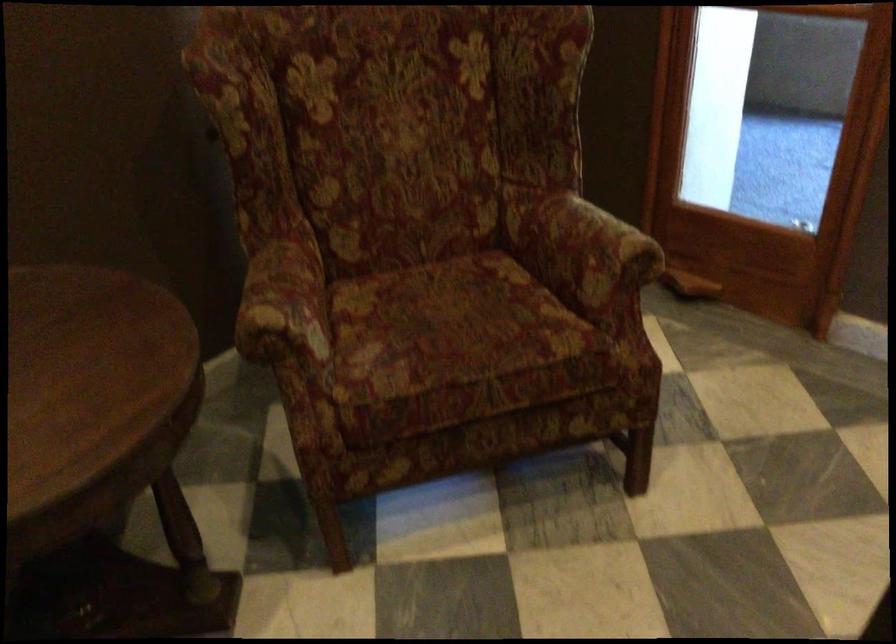
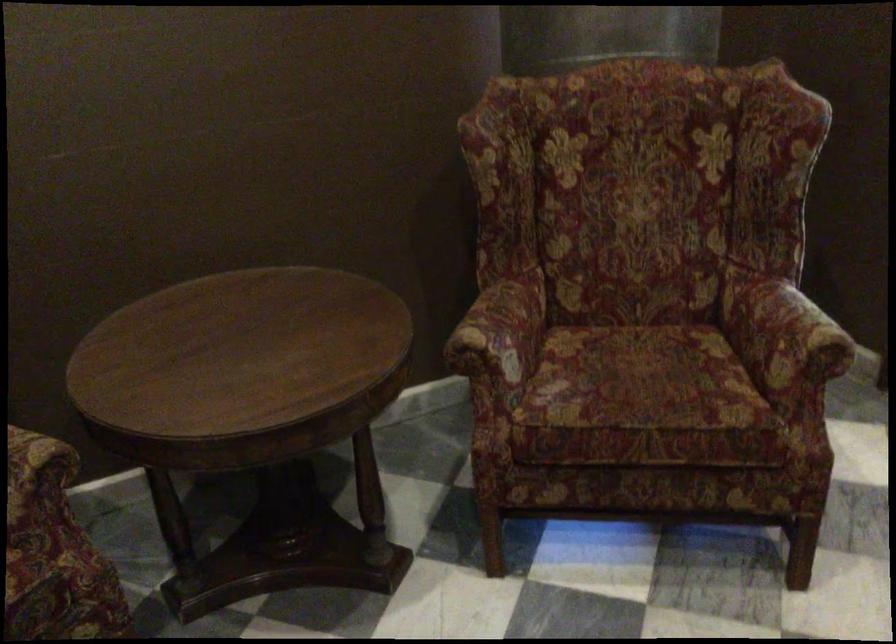
The point at (601, 251) is marked in the first image. Where is the corresponding point in the second image?

(793, 337)